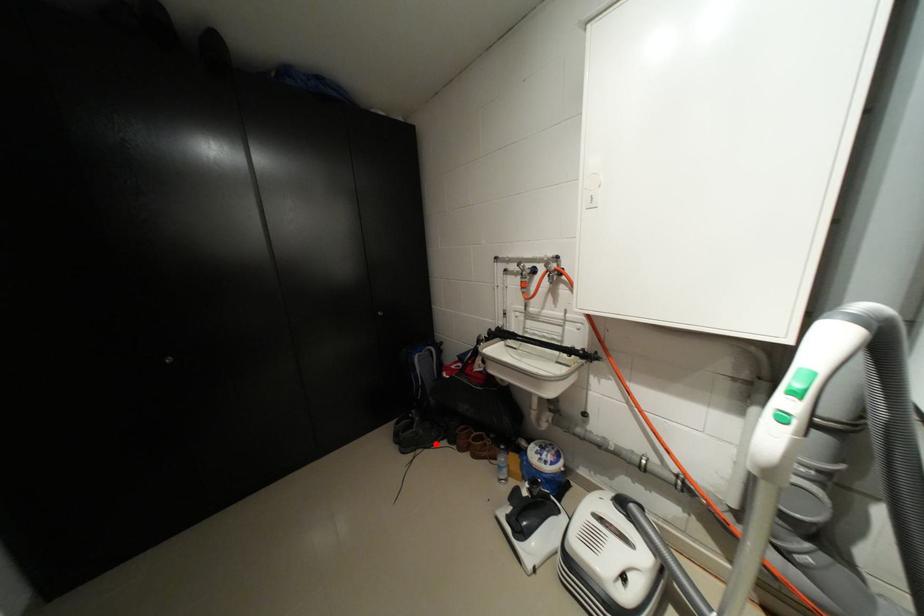
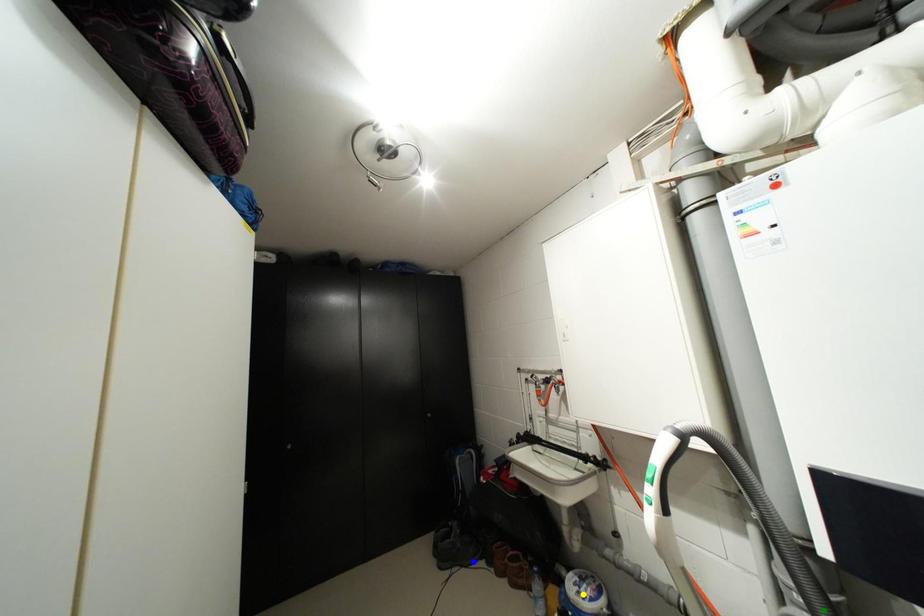
Question: I am providing you with two images of the same scene from different viewpoints. A red point is marked on the first image. You are given multiple points on the second image. Which point in image 2 represents the same 3d spot as the red point in image 1?

Choices:
 (A) blue point
 (B) green point
 (C) yellow point

Answer: (A)